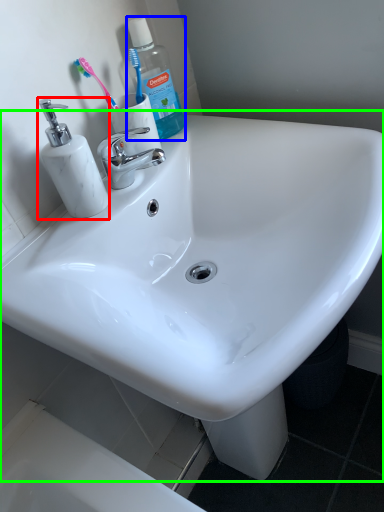
Question: Which object is positioned closest to soap dispenser (highlighted by a red box)? Select from cleaning product (highlighted by a blue box) and sink (highlighted by a green box).

Choices:
 (A) cleaning product
 (B) sink

Answer: (A)